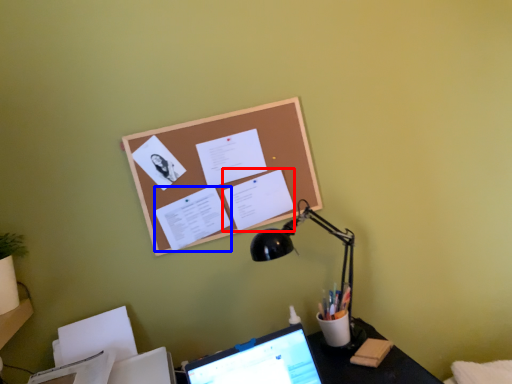
Question: Which of the following is the farthest to the observer, document (highlighted by a red box) or document (highlighted by a blue box)?

Choices:
 (A) document
 (B) document

Answer: (A)